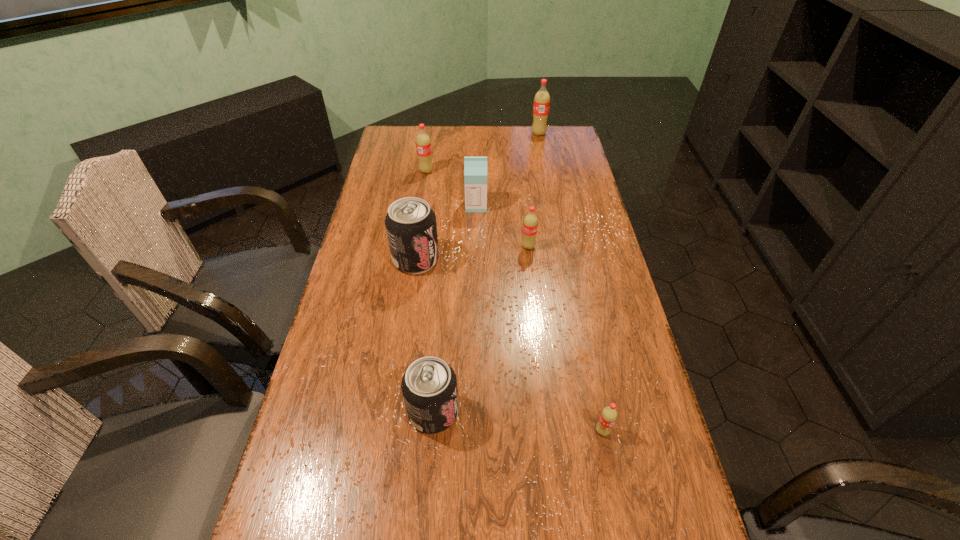
Find the location of a particular element. This screenshot has width=960, height=540. the tallest soda is located at coordinates (541, 105).

At what (x,y) coordinates should I click in order to perform the action: click on the farthest soda. Please return your answer as a coordinate pair (x, y). Looking at the image, I should click on (541, 105).

Where is `the leftmost red soda`? the leftmost red soda is located at coordinates (423, 143).

This screenshot has width=960, height=540. What are the coordinates of `the second farthest red soda` in the screenshot? It's located at (423, 143).

You are a GUI agent. You are given a task and a screenshot of the screen. Output one action in this format:
    pyautogui.click(x=<x>, y=<y>)
    Task: Click on the farther black soda can
    
    Given the screenshot: What is the action you would take?
    pyautogui.click(x=410, y=223)

The width and height of the screenshot is (960, 540). I want to click on milk carton, so click(475, 168).

Where is `the fifth nearest object`? the fifth nearest object is located at coordinates (475, 168).

Image resolution: width=960 pixels, height=540 pixels. Find the location of `the nearer black soda can`. the nearer black soda can is located at coordinates (429, 386).

The image size is (960, 540). I want to click on the third soda from right to left, so click(x=530, y=224).

You are a GUI agent. You are given a task and a screenshot of the screen. Output one action in this format:
    pyautogui.click(x=<x>, y=<y>)
    Task: Click on the second smallest red soda
    The image size is (960, 540).
    Given the screenshot: What is the action you would take?
    point(530,224)